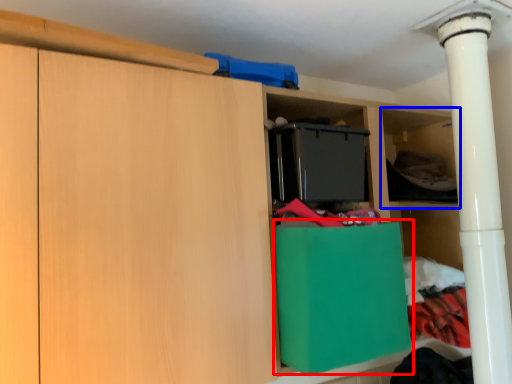
Question: Which object appears farthest to the camera in this image, cabinetry (highlighted by a red box) or shelf (highlighted by a blue box)?

Choices:
 (A) cabinetry
 (B) shelf

Answer: (B)